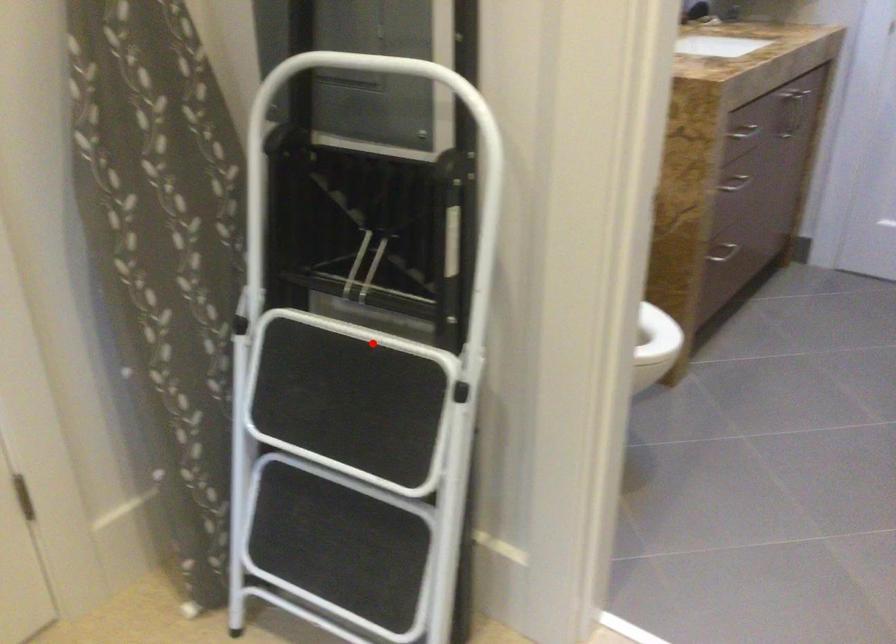
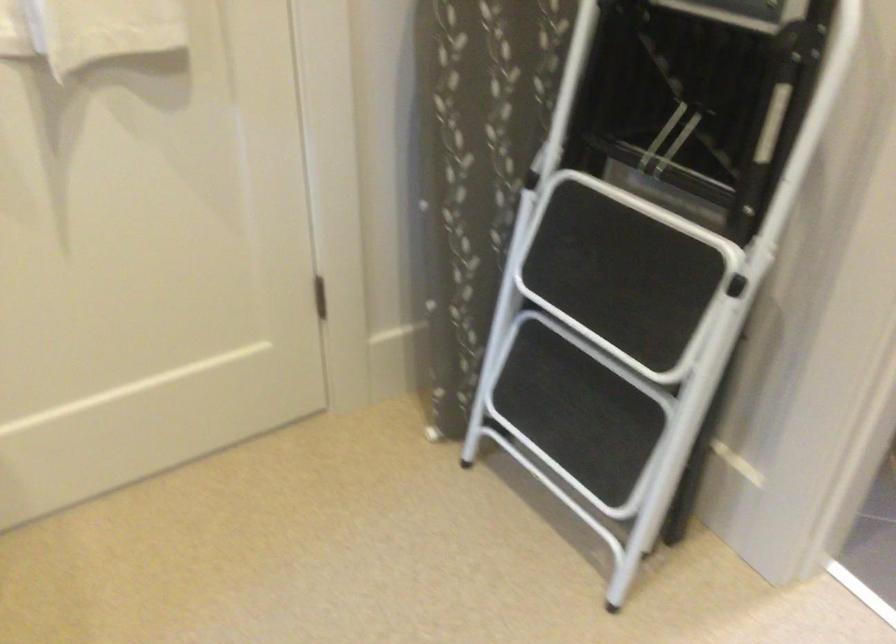
Question: I am providing you with two images of the same scene from different viewpoints. A red point is marked on the first image. Can you still see the location of the red point in image 2?

Choices:
 (A) Yes
 (B) No

Answer: (A)